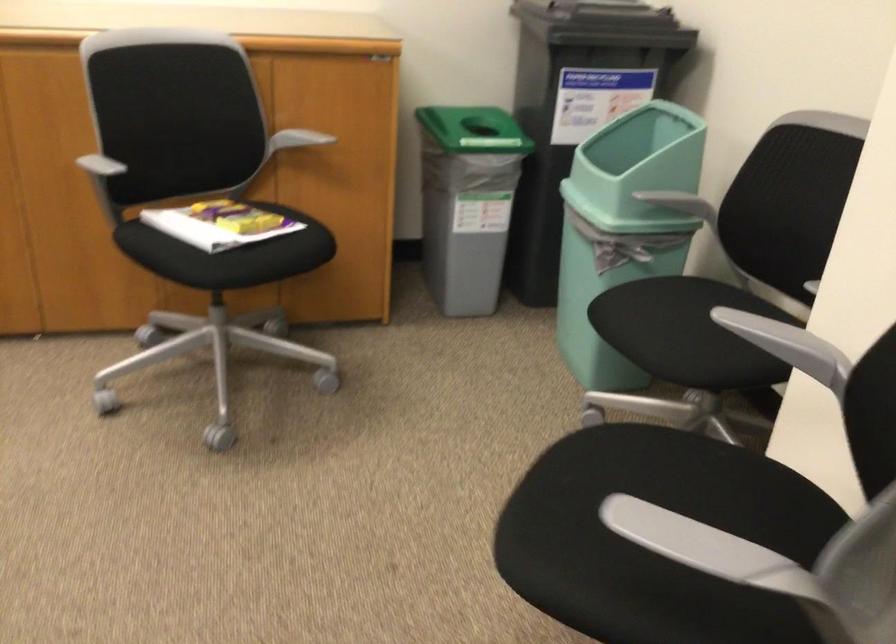
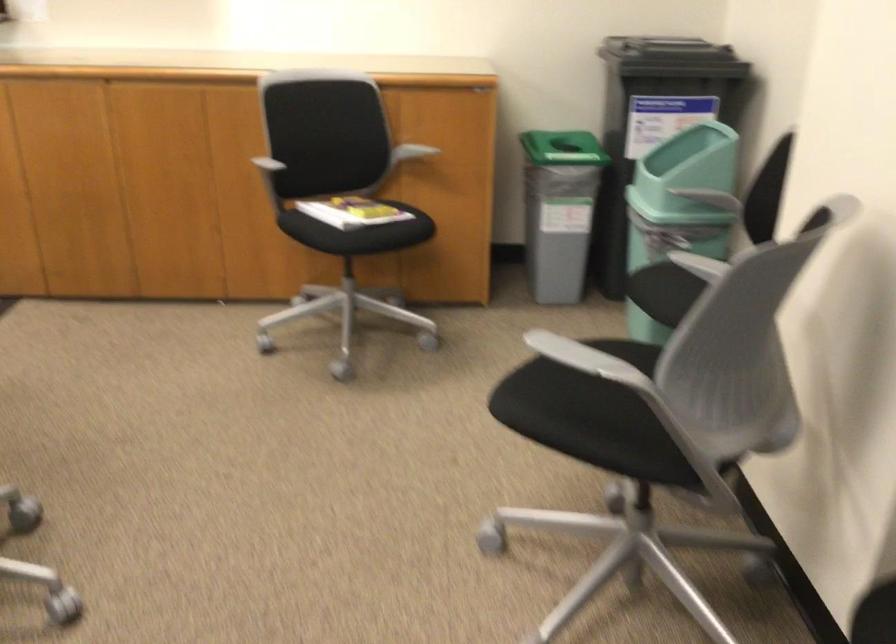
Find the pixel in the second image that matches pixel 227 223 in the first image.

(351, 211)